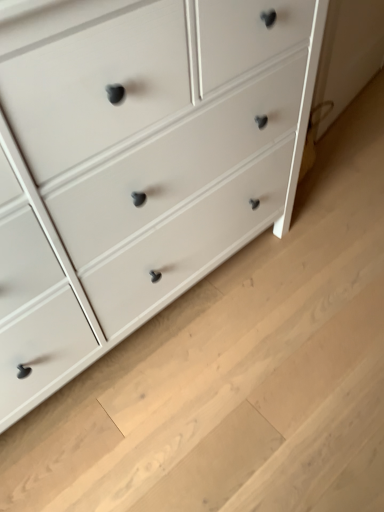
Question: In which direction should I rotate to look at white painted wood chest of drawers at center?

Choices:
 (A) left
 (B) right

Answer: (A)